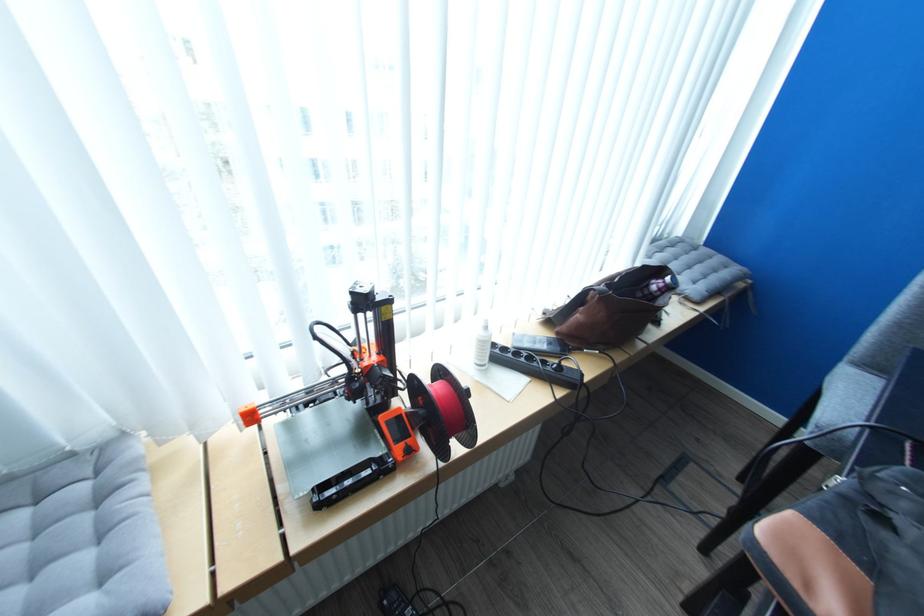
What do you see at coordinates (441, 411) in the screenshot?
I see `the red filament spool` at bounding box center [441, 411].